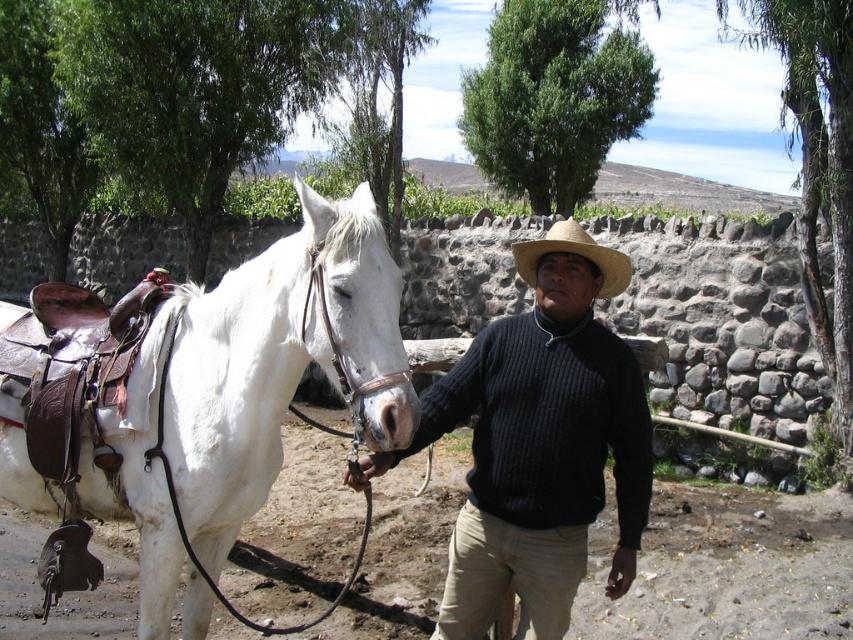
You are a tailor measuring the distance between two items worn by the man in the image. The items are the knitted dark blue sweater at center and the straw hat at center. The tailor needs to ensure there is at least 20 inches between them for proper fitting adjustments. Is the current distance sufficient?

The knitted dark blue sweater at center and the straw hat at center are 22.06 inches apart, which is more than the required 20 inches, so the distance is sufficient for proper fitting adjustments.

You are a photographer positioned behind the man and the horse. You want to take a photo that includes both the white leather saddle at left and the straw hat at center. Which object should you adjust to ensure both are in the frame?

The white leather saddle at left is in front of the straw hat at center. To include both in the frame, you should move the straw hat at center backward so it aligns with the white leather saddle at left or move the saddle forward to be closer to the hat.